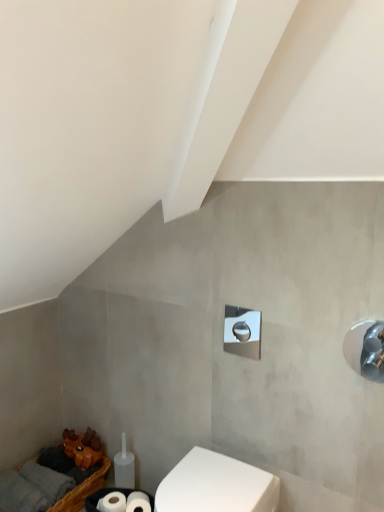
Question: From a real-world perspective, is brown woven basket at lower left on top of white glossy toilet at lower center?

Choices:
 (A) no
 (B) yes

Answer: (A)

Question: Does brown woven basket at lower left have a lesser height compared to white glossy toilet at lower center?

Choices:
 (A) yes
 (B) no

Answer: (A)

Question: Is brown woven basket at lower left bigger than white glossy toilet at lower center?

Choices:
 (A) yes
 (B) no

Answer: (B)

Question: Is brown woven basket at lower left further to the viewer compared to white glossy toilet at lower center?

Choices:
 (A) no
 (B) yes

Answer: (B)

Question: Is white glossy toilet at lower center a part of brown woven basket at lower left?

Choices:
 (A) yes
 (B) no

Answer: (B)

Question: Visually, is brown woven basket at lower left positioned to the left or to the right of polished chrome shower at right, which ranks as the first shower in front-to-back order?

Choices:
 (A) left
 (B) right

Answer: (A)

Question: Is brown woven basket at lower left spatially inside polished chrome shower at right, which ranks as the first shower in front-to-back order, or outside of it?

Choices:
 (A) inside
 (B) outside

Answer: (B)

Question: From the image's perspective, is brown woven basket at lower left located above or below polished chrome shower at right, which is counted as the first shower, starting from the right?

Choices:
 (A) above
 (B) below

Answer: (B)

Question: From their relative heights in the image, would you say brown woven basket at lower left is taller or shorter than polished chrome shower at right, the second shower in the back-to-front sequence?

Choices:
 (A) tall
 (B) short

Answer: (B)

Question: Looking at their shapes, would you say polished chrome shower at right, the second shower in the back-to-front sequence, is wider or thinner than polished chrome shower at center, which is the 1th shower in back-to-front order?

Choices:
 (A) thin
 (B) wide

Answer: (A)

Question: In terms of height, does polished chrome shower at right, the second shower in the back-to-front sequence, look taller or shorter compared to polished chrome shower at center, which is the 1th shower in back-to-front order?

Choices:
 (A) tall
 (B) short

Answer: (A)

Question: From the image's perspective, is polished chrome shower at right, the second shower in the back-to-front sequence, positioned above or below polished chrome shower at center, marked as the second shower in a front-to-back arrangement?

Choices:
 (A) above
 (B) below

Answer: (B)

Question: Is point (357, 327) closer or farther from the camera than point (248, 342)?

Choices:
 (A) closer
 (B) farther

Answer: (A)

Question: Considering the positions of white glossy toilet at lower center and polished chrome shower at center, which is the 2th shower in right-to-left order, in the image, is white glossy toilet at lower center wider or thinner than polished chrome shower at center, which is the 2th shower in right-to-left order,?

Choices:
 (A) thin
 (B) wide

Answer: (B)

Question: Based on their sizes in the image, would you say white glossy toilet at lower center is bigger or smaller than polished chrome shower at center, marked as the second shower in a front-to-back arrangement?

Choices:
 (A) small
 (B) big

Answer: (B)